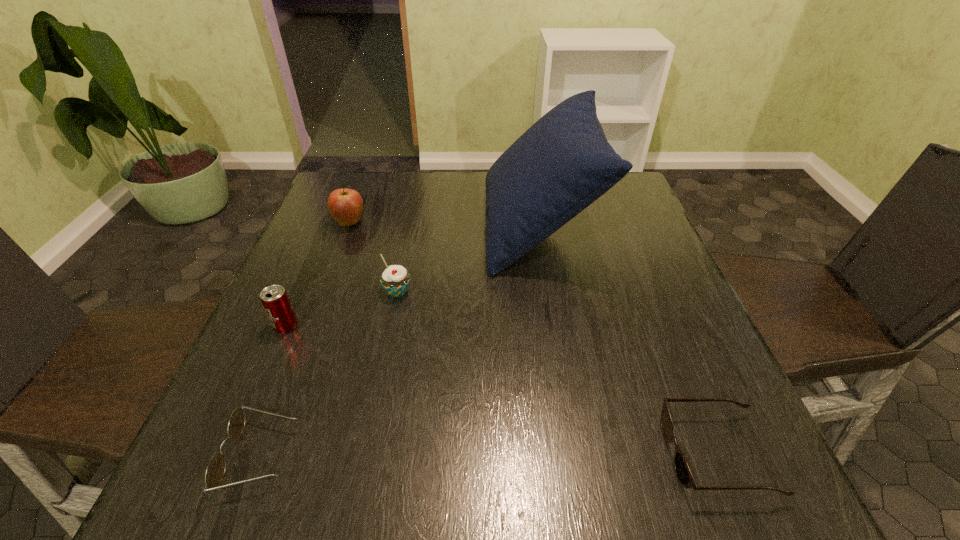
The height and width of the screenshot is (540, 960). I want to click on vacant point located between the spectacles and the third nearest object, so click(x=274, y=391).

Locate an element on the screen. This screenshot has height=540, width=960. empty location between the cushion and the third object from right to left is located at coordinates (468, 260).

The height and width of the screenshot is (540, 960). Identify the location of unoccupied area between the spectacles and the apple. (305, 339).

Where is `empty space that is in between the second object from right to left and the spectacles`? empty space that is in between the second object from right to left and the spectacles is located at coordinates (399, 341).

You are a GUI agent. You are given a task and a screenshot of the screen. Output one action in this format:
    pyautogui.click(x=<x>, y=<y>)
    Task: Click on the vacant space in between the sunglasses and the beer can
    The image size is (960, 540).
    Given the screenshot: What is the action you would take?
    pyautogui.click(x=501, y=390)

Image resolution: width=960 pixels, height=540 pixels. Find the location of `free area in between the rightmost object and the cushion`. free area in between the rightmost object and the cushion is located at coordinates (627, 341).

The width and height of the screenshot is (960, 540). I want to click on free space that is in between the rightmost object and the apple, so click(x=533, y=339).

I want to click on blank region between the apple and the fourth nearest object, so click(x=373, y=258).

Locate an element on the screen. This screenshot has width=960, height=540. object that stands as the fourth closest to the beer can is located at coordinates (563, 163).

Identify the location of the closest object to the spectacles. The image size is (960, 540). (274, 299).